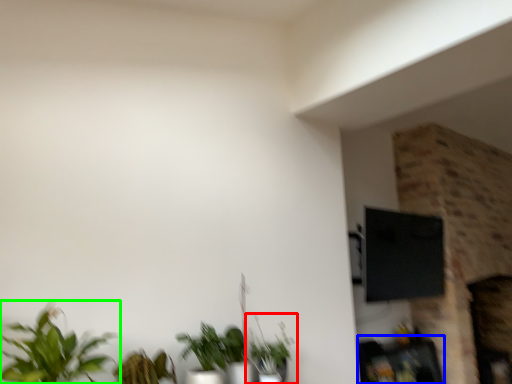
Question: Which is farther away from houseplant (highlighted by a red box)? furniture (highlighted by a blue box) or houseplant (highlighted by a green box)?

Choices:
 (A) furniture
 (B) houseplant

Answer: (A)